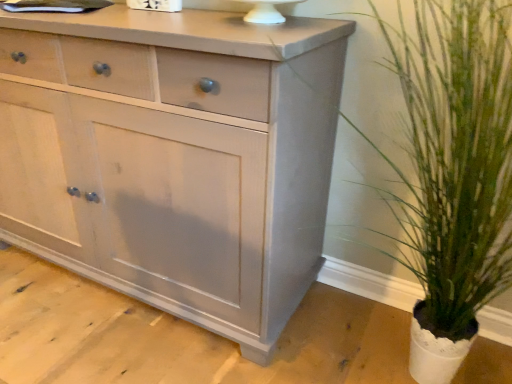
What are the coordinates of `matte gray cabinet at center` in the screenshot? It's located at (174, 157).

What do you see at coordinates (174, 157) in the screenshot? I see `matte gray cabinet at center` at bounding box center [174, 157].

The width and height of the screenshot is (512, 384). Identify the location of green leafy plant at right. (453, 171).

The width and height of the screenshot is (512, 384). Describe the element at coordinates (453, 171) in the screenshot. I see `green leafy plant at right` at that location.

At what (x,y) coordinates should I click in order to perform the action: click on matte gray cabinet at center. Please return your answer as a coordinate pair (x, y). This screenshot has width=512, height=384. Looking at the image, I should click on (174, 157).

Is matte gray cabinet at center to the right of green leafy plant at right from the viewer's perspective?

No.

In the image, is matte gray cabinet at center positioned in front of or behind green leafy plant at right?

matte gray cabinet at center is behind green leafy plant at right.

Considering the points (68, 152) and (444, 22), which point is in front, point (68, 152) or point (444, 22)?

The point (444, 22) is in front.

From the image's perspective, which is above, matte gray cabinet at center or green leafy plant at right?

matte gray cabinet at center.

From a real-world perspective, between matte gray cabinet at center and green leafy plant at right, who is vertically lower?

In real-world perspective, matte gray cabinet at center is lower.

Based on the photo, in terms of width, does matte gray cabinet at center look wider or thinner when compared to green leafy plant at right?

matte gray cabinet at center is thinner than green leafy plant at right.

Does matte gray cabinet at center have a greater height compared to green leafy plant at right?

Correct, matte gray cabinet at center is much taller as green leafy plant at right.

Consider the image. Is matte gray cabinet at center smaller than green leafy plant at right?

No.

Would you say green leafy plant at right is part of matte gray cabinet at center's contents?

No.

Would you consider matte gray cabinet at center to be distant from green leafy plant at right?

No, matte gray cabinet at center is in close proximity to green leafy plant at right.

Is matte gray cabinet at center oriented away from green leafy plant at right?

No, matte gray cabinet at center is not facing the opposite direction of green leafy plant at right.

How many degrees apart are the facing directions of matte gray cabinet at center and green leafy plant at right?

The angular difference between matte gray cabinet at center and green leafy plant at right is 1.71 degrees.

Identify the location of the chest of drawers beneath the green leafy plant at right (from a real-world perspective). (174, 157).

Between green leafy plant at right and matte gray cabinet at center, which one appears on the right side from the viewer's perspective?

green leafy plant at right.

Is green leafy plant at right behind matte gray cabinet at center?

No, it is not.

Considering the positions of points (507, 101) and (46, 233), is point (507, 101) farther from camera compared to point (46, 233)?

No, it is not.

From the image's perspective, is green leafy plant at right on top of matte gray cabinet at center?

Actually, green leafy plant at right appears below matte gray cabinet at center in the image.

From a real-world perspective, is green leafy plant at right positioned under matte gray cabinet at center based on gravity?

Answer: Incorrect, from a real-world perspective, green leafy plant at right is higher than matte gray cabinet at center.

Between green leafy plant at right and matte gray cabinet at center, which one has smaller width?

matte gray cabinet at center is thinner.

Considering the sizes of green leafy plant at right and matte gray cabinet at center in the image, is green leafy plant at right taller or shorter than matte gray cabinet at center?

In the image, green leafy plant at right appears to be shorter than matte gray cabinet at center.

Which of these two, green leafy plant at right or matte gray cabinet at center, is bigger?

matte gray cabinet at center is bigger.

Looking at this image, would you say green leafy plant at right is outside matte gray cabinet at center?

green leafy plant at right is positioned outside matte gray cabinet at center.

Is green leafy plant at right placed right next to matte gray cabinet at center?

No, green leafy plant at right is not in contact with matte gray cabinet at center.

Is green leafy plant at right oriented away from matte gray cabinet at center?

No, green leafy plant at right is not facing the opposite direction of matte gray cabinet at center.

What's the angular difference between green leafy plant at right and matte gray cabinet at center's facing directions?

There is a 1.71-degree angle between the facing directions of green leafy plant at right and matte gray cabinet at center.

Looking at this image, how far apart are green leafy plant at right and matte gray cabinet at center?

The distance of green leafy plant at right from matte gray cabinet at center is 54.59 centimeters.

Where is `the chest of drawers lying behind the green leafy plant at right`? the chest of drawers lying behind the green leafy plant at right is located at coordinates (174, 157).

Where is `the chest of drawers behind the green leafy plant at right`? The height and width of the screenshot is (384, 512). the chest of drawers behind the green leafy plant at right is located at coordinates (174, 157).

The width and height of the screenshot is (512, 384). In the image, there is a matte gray cabinet at center. What are the coordinates of `houseplant below it (from the image's perspective)` in the screenshot? It's located at (453, 171).